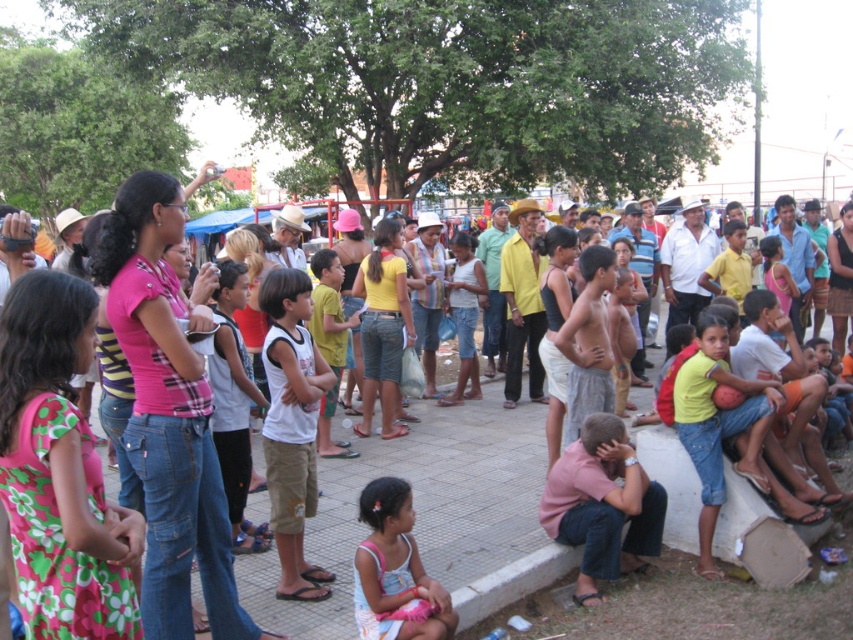
You are standing at the edge of the pavement in the park scene. You see the jeans at center and the yellow matte shirt at lower right. Which object is positioned more to the right?

The yellow matte shirt at lower right is positioned more to the right than the jeans at center.